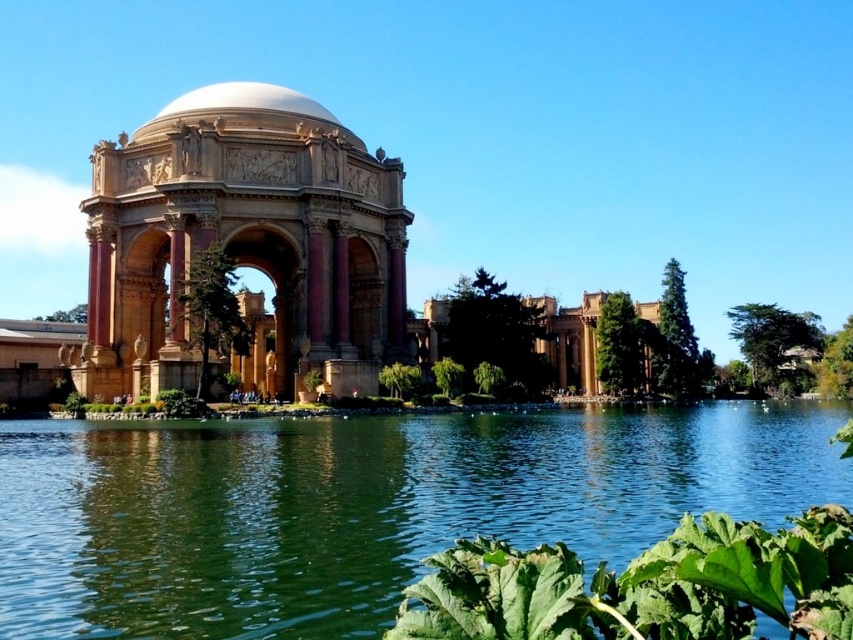
Is the position of green liquid water at center less distant than that of white marble dome at upper center?

Yes.

Which is behind, point (117, 484) or point (177, 109)?

Positioned behind is point (177, 109).

In order to click on green liquid water at center in this screenshot , I will do `click(363, 506)`.

Which is more to the left, golden stone gazebo at center or white marble dome at upper center?

white marble dome at upper center

Is point (294, 243) farther from viewer compared to point (200, 90)?

No.

Between point (277, 305) and point (250, 109), which one is positioned in front?

Point (250, 109) is in front.

Locate an element on the screen. golden stone gazebo at center is located at coordinates click(x=244, y=240).

Is green liquid water at center below golden stone gazebo at center?

Yes, green liquid water at center is below golden stone gazebo at center.

Which is above, green liquid water at center or golden stone gazebo at center?

Positioned higher is golden stone gazebo at center.

Identify the location of green liquid water at center. (363, 506).

The width and height of the screenshot is (853, 640). In order to click on green liquid water at center in this screenshot , I will do `click(363, 506)`.